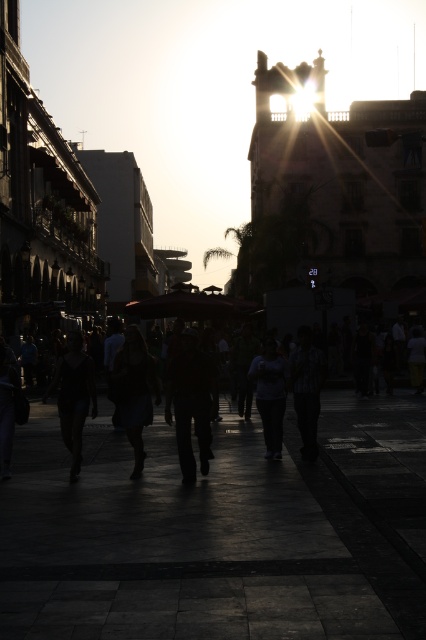
Based on the photo, you are standing at the point with coordinates point (273, 348) in the urban scene. You want to walk towards the point with coordinates point (310, 413). According to the scene description, will you be moving forward or backward relative to your current position?

Since point (310, 413) is in front of point (273, 348), moving towards it would mean you are moving forward relative to your current position at point (273, 348).

You are standing at the point marked as point [373,445] and want to cross the street. Are there any obstacles directly in front of you?

The silhouette pedestrians at center is located at point [373,445], so there is an obstacle directly in front of you at that point.